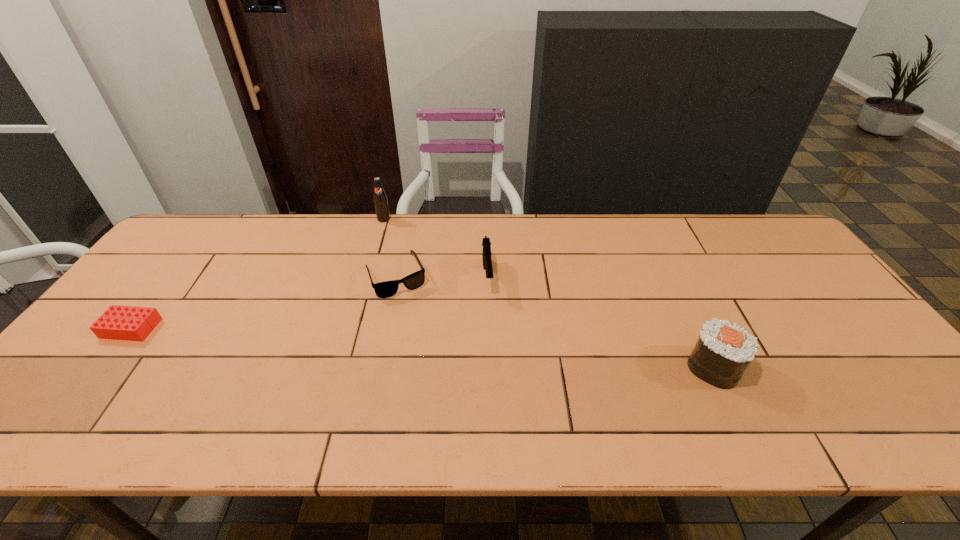
Where is `Lego`? Lego is located at coordinates (130, 323).

Find the location of a particular element. This screenshot has height=540, width=960. the leftmost object is located at coordinates (130, 323).

Where is `the rightmost object`? This screenshot has height=540, width=960. the rightmost object is located at coordinates (723, 351).

You are a GUI agent. You are given a task and a screenshot of the screen. Output one action in this format:
    pyautogui.click(x=<x>, y=<y>)
    Task: Click on the sushi
    
    Given the screenshot: What is the action you would take?
    pyautogui.click(x=723, y=351)

Locate an element on the screen. sunglasses is located at coordinates (386, 289).

This screenshot has width=960, height=540. I want to click on the tallest object, so click(x=380, y=199).

The image size is (960, 540). Identify the location of pop. (380, 199).

Identify the location of the second object from right to left. Image resolution: width=960 pixels, height=540 pixels. (486, 254).

Find the location of `vacant space located 0.160m on the right of the leftmost object`. vacant space located 0.160m on the right of the leftmost object is located at coordinates (218, 328).

Where is `vacant space situated on the right of the rightmost object`? vacant space situated on the right of the rightmost object is located at coordinates (828, 367).